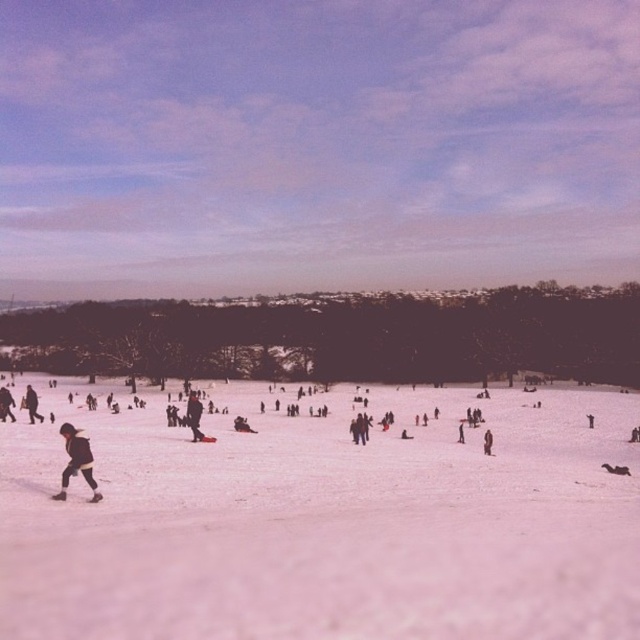
Which is more to the left, white snow at center or black matte jacket at center?

black matte jacket at center

Who is shorter, white snow at center or black matte jacket at center?

Standing shorter between the two is white snow at center.

Where is `white snow at center`? The width and height of the screenshot is (640, 640). white snow at center is located at coordinates (326, 522).

Which is above, white snow at center or dark brown jacket at lower left?

dark brown jacket at lower left is higher up.

Between point (154, 420) and point (77, 452), which one is positioned behind?

Positioned behind is point (154, 420).

Image resolution: width=640 pixels, height=640 pixels. I want to click on white snow at center, so click(x=326, y=522).

Identify the location of dark brown jacket at lower left. (76, 461).

Which is more to the right, dark brown jacket at lower left or brown woolen coat at center?

From the viewer's perspective, brown woolen coat at center appears more on the right side.

Describe the element at coordinates (76, 461) in the screenshot. The height and width of the screenshot is (640, 640). I see `dark brown jacket at lower left` at that location.

You are a GUI agent. You are given a task and a screenshot of the screen. Output one action in this format:
    pyautogui.click(x=<x>, y=<y>)
    Task: Click on the dark brown jacket at lower left
    
    Given the screenshot: What is the action you would take?
    pyautogui.click(x=76, y=461)